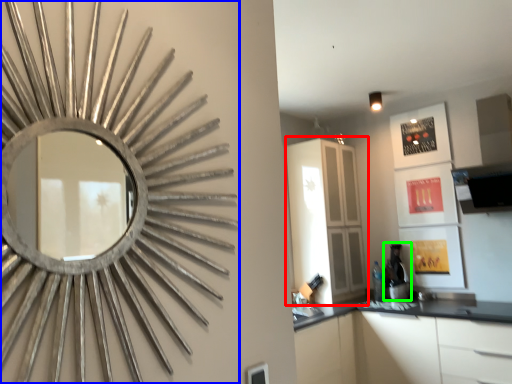
Question: Which is farther away from dresser (highlighted by a red box)? oval (highlighted by a blue box) or coffee machine (highlighted by a green box)?

Choices:
 (A) oval
 (B) coffee machine

Answer: (A)